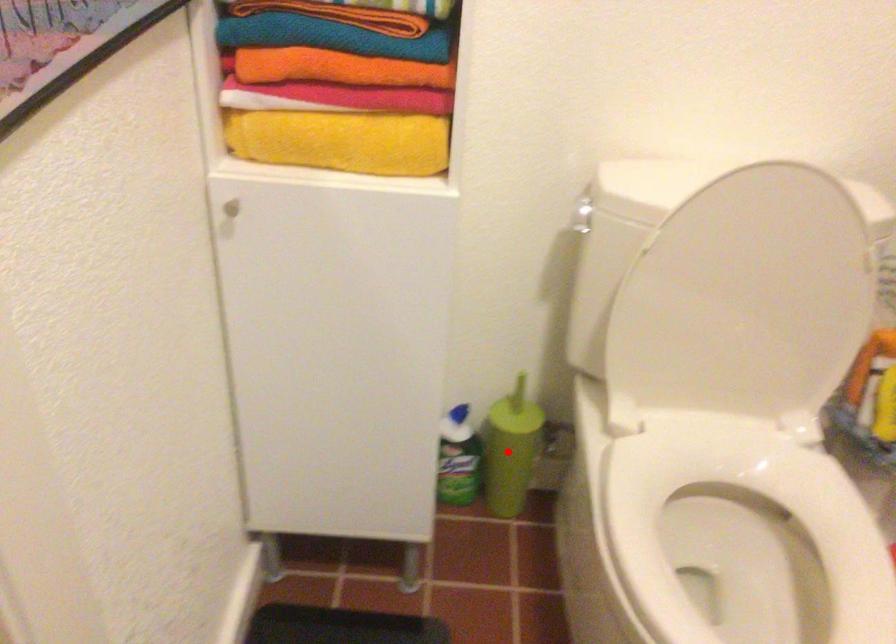
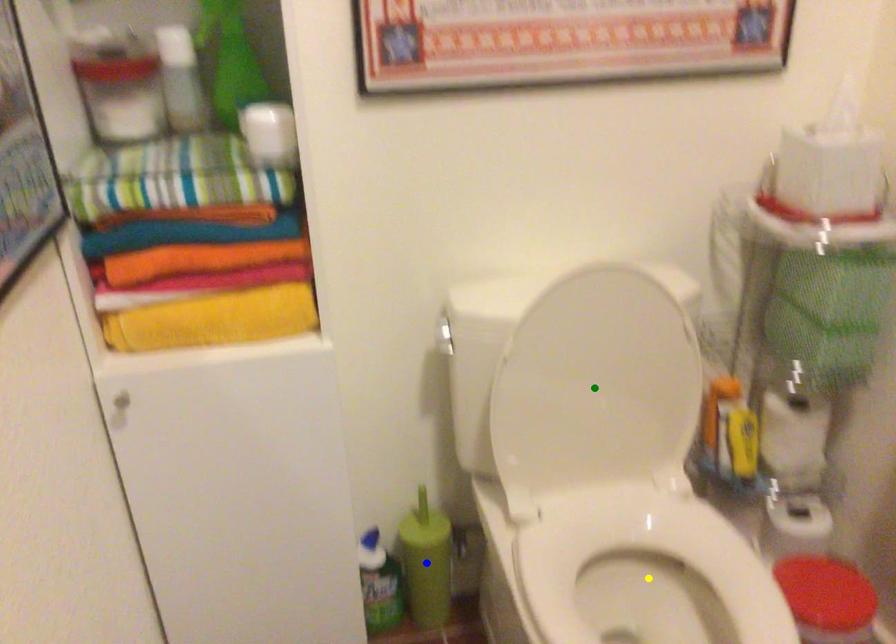
Question: I am providing you with two images of the same scene from different viewpoints. A red point is marked on the first image. You are given multiple points on the second image. Which mark in image 2 goes with the point in image 1?

Choices:
 (A) green point
 (B) yellow point
 (C) blue point

Answer: (C)